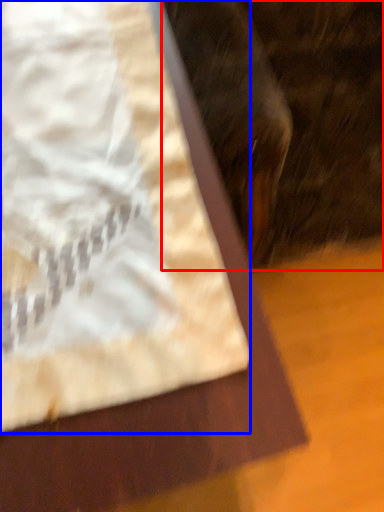
Question: Which point is further to the camera, animal (highlighted by a red box) or sheet (highlighted by a blue box)?

Choices:
 (A) animal
 (B) sheet

Answer: (B)